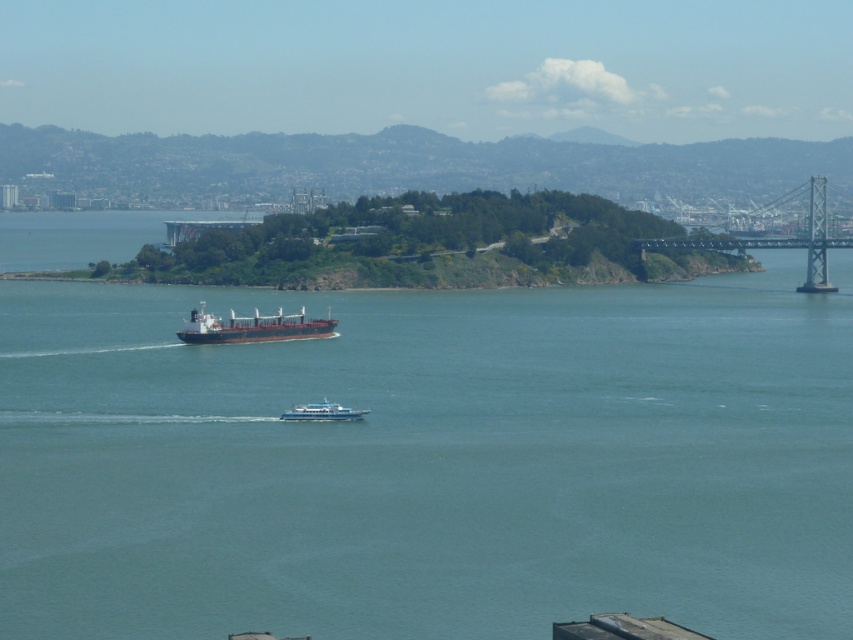
Find the location of a particular element. greenish-blue water at center is located at coordinates (430, 460).

Who is positioned more to the right, greenish-blue water at center or metallic gray suspension bridge at right?

From the viewer's perspective, metallic gray suspension bridge at right appears more on the right side.

Which is behind, point (701, 416) or point (822, 291)?

Point (822, 291)

The width and height of the screenshot is (853, 640). I want to click on greenish-blue water at center, so click(x=430, y=460).

Who is higher up, metallic gray suspension bridge at right or white glossy boat at center?

metallic gray suspension bridge at right is above.

Is metallic gray suspension bridge at right closer to the viewer compared to white glossy boat at center?

No.

In order to click on metallic gray suspension bridge at right in this screenshot , I will do `click(776, 241)`.

Who is taller, greenish-blue water at center or white glossy boat at center?

greenish-blue water at center

Measure the distance between greenish-blue water at center and white glossy boat at center.

greenish-blue water at center and white glossy boat at center are 56.52 meters apart.

The width and height of the screenshot is (853, 640). What are the coordinates of `greenish-blue water at center` in the screenshot? It's located at (430, 460).

The image size is (853, 640). In order to click on greenish-blue water at center in this screenshot , I will do `click(430, 460)`.